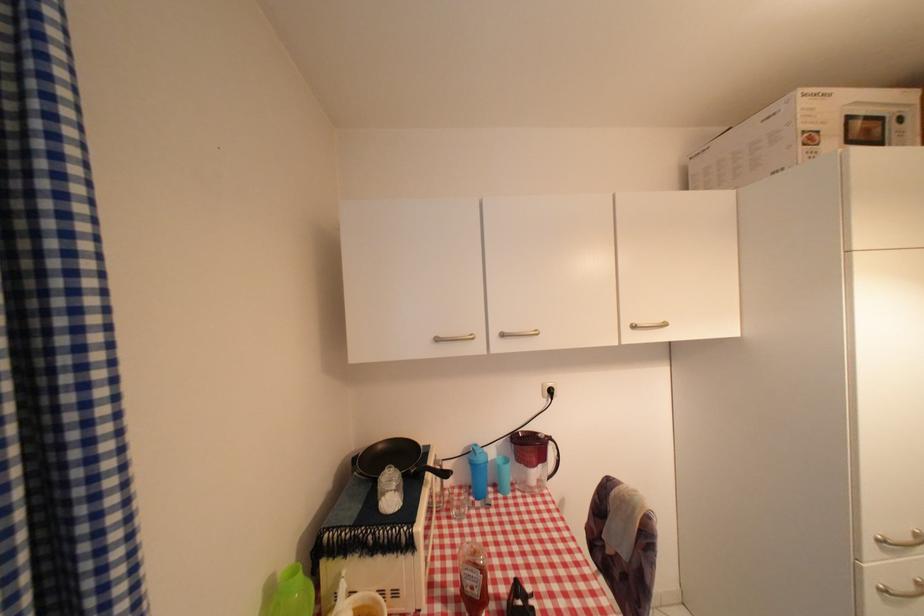
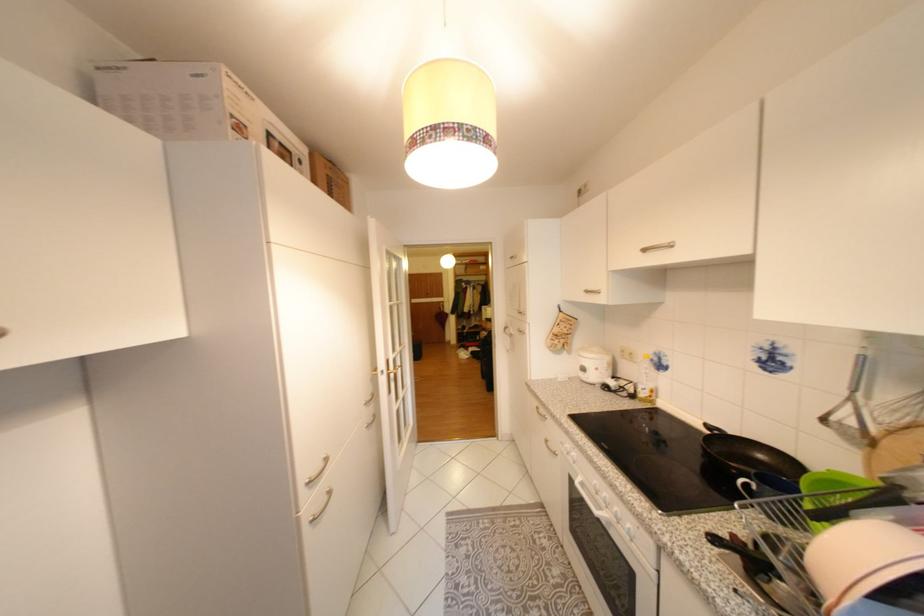
Find the pixel in the second image that matches [868,568] in the first image.

(308, 519)